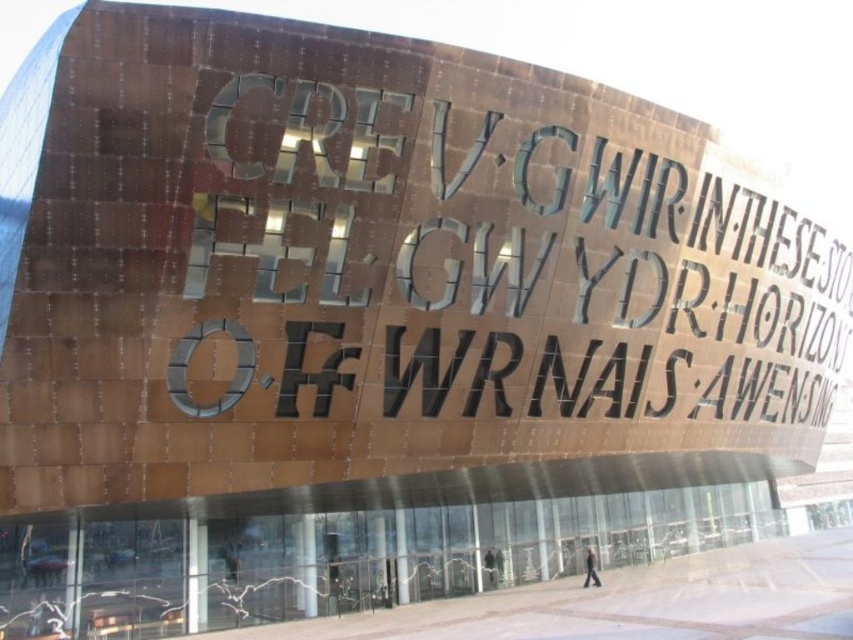
Does dark gray jacket at lower center appear over dark gray suit at center?

No.

Between dark gray jacket at lower center and dark gray suit at center, which one is positioned higher?

dark gray suit at center is above.

You are a GUI agent. You are given a task and a screenshot of the screen. Output one action in this format:
    pyautogui.click(x=<x>, y=<y>)
    Task: Click on the dark gray jacket at lower center
    
    Given the screenshot: What is the action you would take?
    pyautogui.click(x=590, y=568)

Who is lower down, dark gray jacket at lower center or dark gray jacket at center?

dark gray jacket at lower center is below.

From the picture: Is dark gray jacket at lower center below dark gray jacket at center?

Correct, dark gray jacket at lower center is located below dark gray jacket at center.

Describe the element at coordinates (590, 568) in the screenshot. I see `dark gray jacket at lower center` at that location.

This screenshot has height=640, width=853. Find the location of `dark gray jacket at lower center`. dark gray jacket at lower center is located at coordinates (590, 568).

Which of these two, dark gray jacket at center or dark gray suit at center, stands taller?

With more height is dark gray jacket at center.

Image resolution: width=853 pixels, height=640 pixels. I want to click on dark gray jacket at center, so click(x=490, y=566).